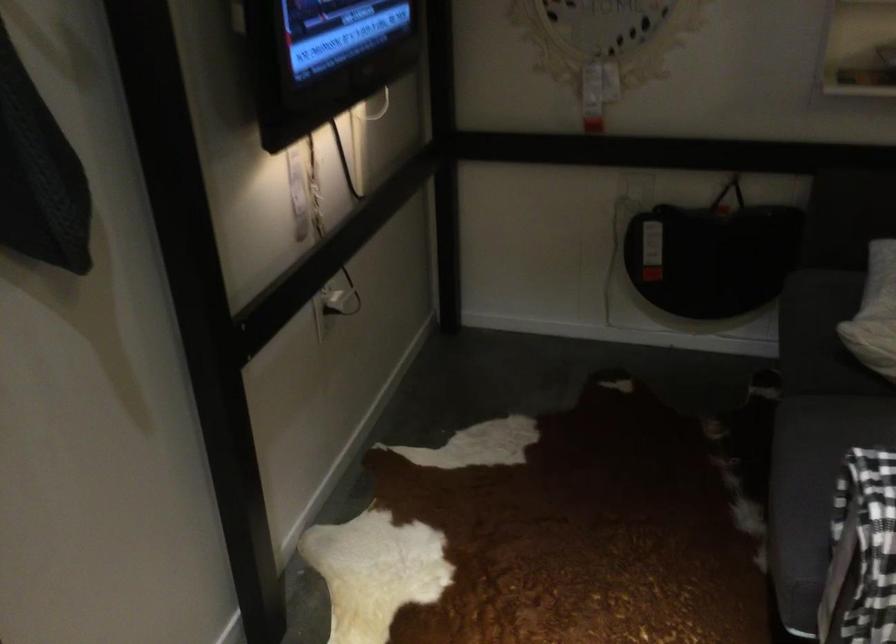
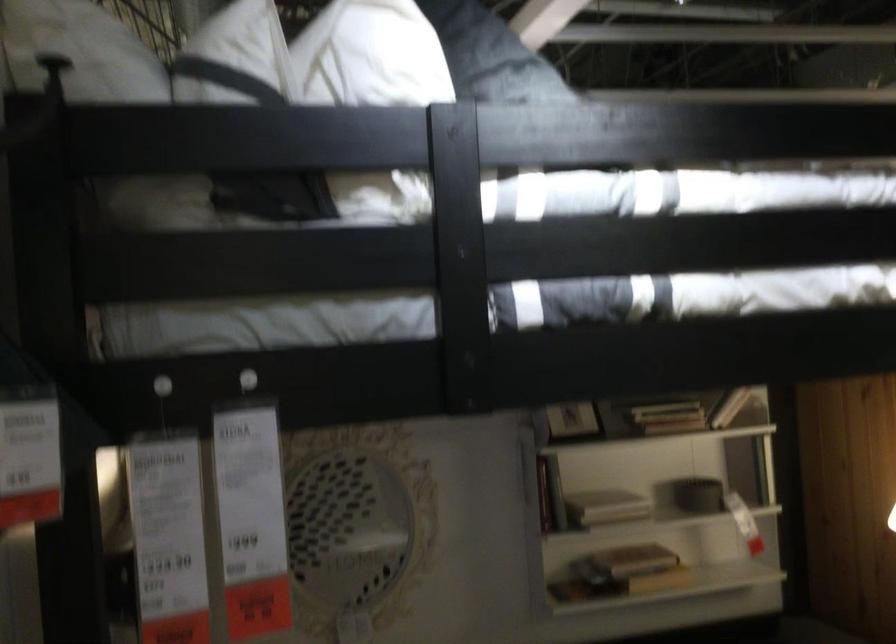
First-person continuous shooting, in which direction is the camera rotating?

The camera's rotation is toward right-up.